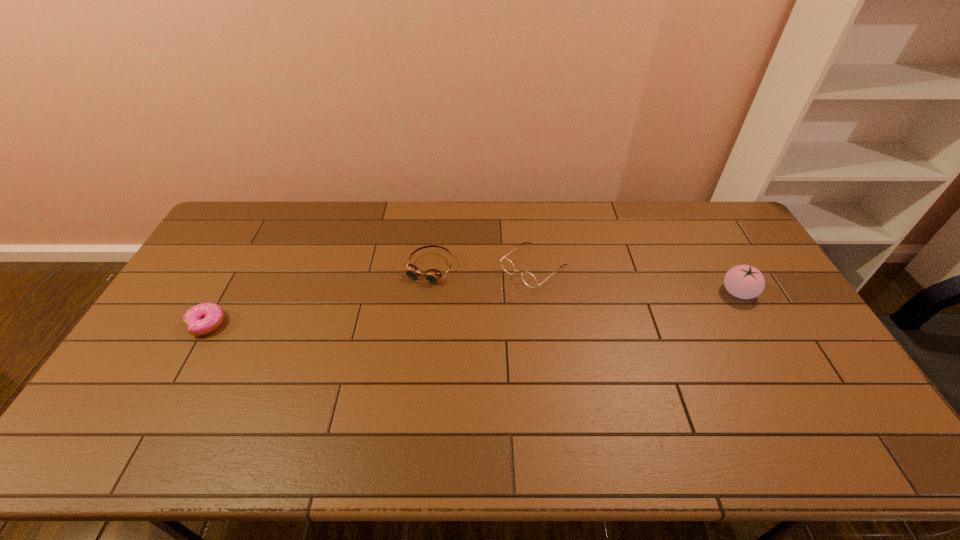
You are a GUI agent. You are given a task and a screenshot of the screen. Output one action in this format:
    pyautogui.click(x=<x>, y=<y>)
    Task: Click on the vacant region between the rightmost object and the second object from left to right
    
    Given the screenshot: What is the action you would take?
    pyautogui.click(x=585, y=280)

Where is `object that is the third closest to the tallest object`? This screenshot has width=960, height=540. object that is the third closest to the tallest object is located at coordinates (204, 318).

Identify which object is the third closest to the second object from right to left. Please provide its 2D coordinates. Your answer should be formatted as a tuple, i.e. [(x, y)], where the tuple contains the x and y coordinates of a point satisfying the conditions above.

[(204, 318)]

Find the location of a particular element. The width and height of the screenshot is (960, 540). blank space that satisfies the following two spatial constraints: 1. on the front side of the second object from left to right; 2. on the left side of the rightmost object is located at coordinates (427, 292).